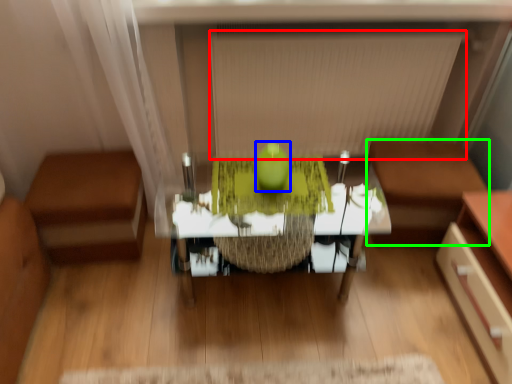
Question: Which is nearer to the blind (highlighted by a red box)? apple (highlighted by a blue box) or furniture (highlighted by a green box).

Choices:
 (A) apple
 (B) furniture

Answer: (B)